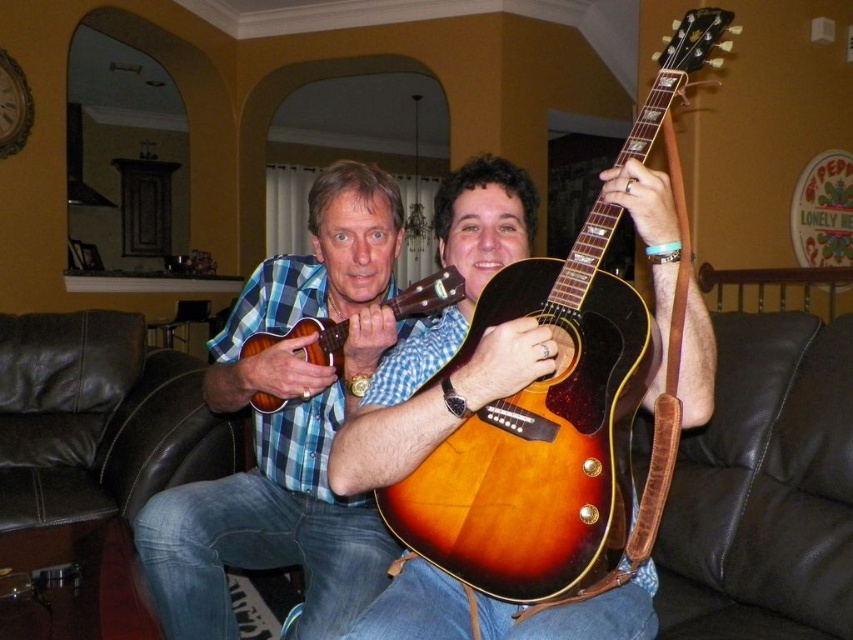
Question: Which point appears closest to the camera in this image?

Choices:
 (A) (312, 340)
 (B) (496, 525)
 (C) (213, 620)

Answer: (B)

Question: Which point is farther to the camera?

Choices:
 (A) sunburst wood guitar at center
 (B) brown leather armchair at right

Answer: (A)

Question: Can you confirm if matte plaid shirt at center is positioned above brown leather armchair at right?

Choices:
 (A) no
 (B) yes

Answer: (B)

Question: Does satin wood guitar at center appear on the left side of sunburst wood guitar at center?

Choices:
 (A) no
 (B) yes

Answer: (A)

Question: Which point is farther to the camera?

Choices:
 (A) (293, 291)
 (B) (817, 636)

Answer: (A)

Question: Is satin brown guitar at center closer to the viewer compared to brown leather armchair at right?

Choices:
 (A) yes
 (B) no

Answer: (A)